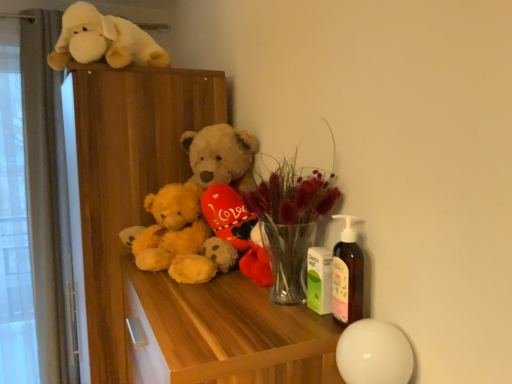
Where is `free location in front of green matte lotion bottle at center, the 1th toy from the right`? free location in front of green matte lotion bottle at center, the 1th toy from the right is located at coordinates (300, 337).